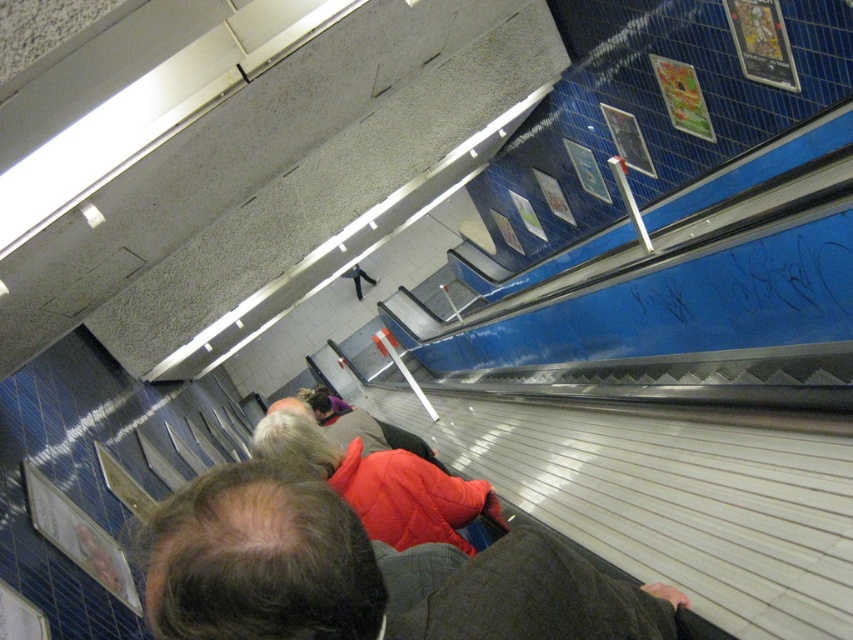
You are a person standing on the escalator in the subway station. You see a red quilted jacket at center and a red puffy coat at center. Which one is narrower?

The red quilted jacket at center is thinner than the red puffy coat at center, so the red quilted jacket at center is narrower.

You are standing on the escalator in the subway station and see both the red quilted jacket at center and the red puffy coat at center. Which one is positioned higher up on the escalator steps?

The red quilted jacket at center is positioned higher up on the escalator steps because it is located above the red puffy coat at center.

You are standing on the escalator and see both the red quilted jacket at center and the red puffy coat at center. Which one is closer to you?

The red quilted jacket at center is closer to you because it is in front of the red puffy coat at center.